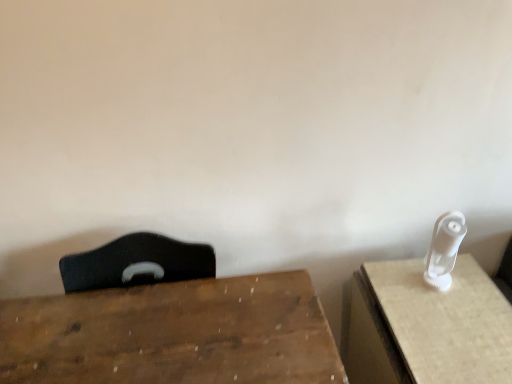
The image size is (512, 384). I want to click on free space to the left of white plastic wii controller at right, so click(x=396, y=291).